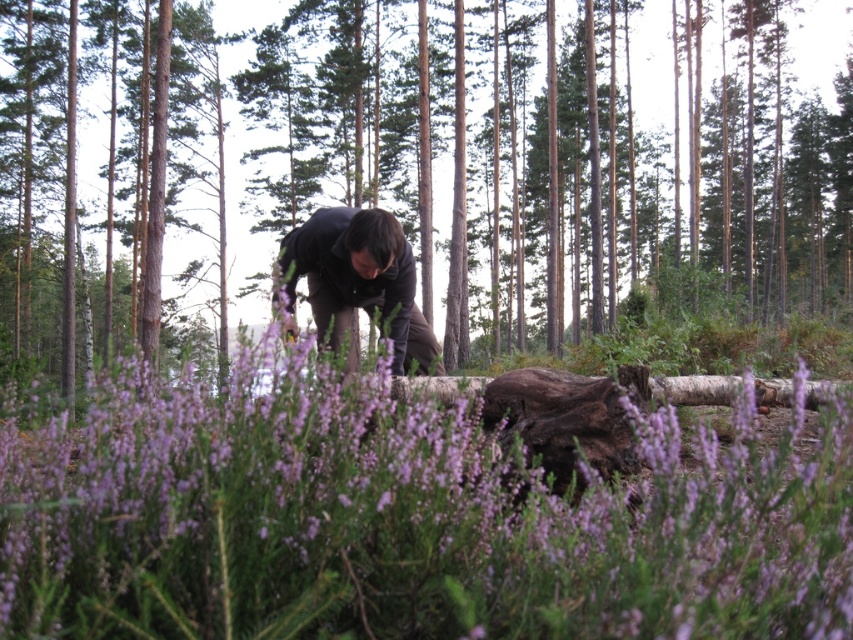
Question: Is brown rough log at center below dark brown fabric at center?

Choices:
 (A) no
 (B) yes

Answer: (A)

Question: Does purple soft-textured flowers at center appear under dark brown fabric at center?

Choices:
 (A) no
 (B) yes

Answer: (B)

Question: Which of the following is the farthest from the observer?

Choices:
 (A) 274,81
 (B) 294,253

Answer: (A)

Question: Estimate the real-world distances between objects in this image. Which object is farther from the dark brown fabric at center?

Choices:
 (A) brown rough log at center
 (B) purple soft-textured flowers at center

Answer: (A)

Question: Can you confirm if brown rough log at center is positioned above dark brown fabric at center?

Choices:
 (A) yes
 (B) no

Answer: (A)

Question: Among these points, which one is nearest to the camera?

Choices:
 (A) (645, 580)
 (B) (614, 260)
 (C) (432, 356)

Answer: (A)